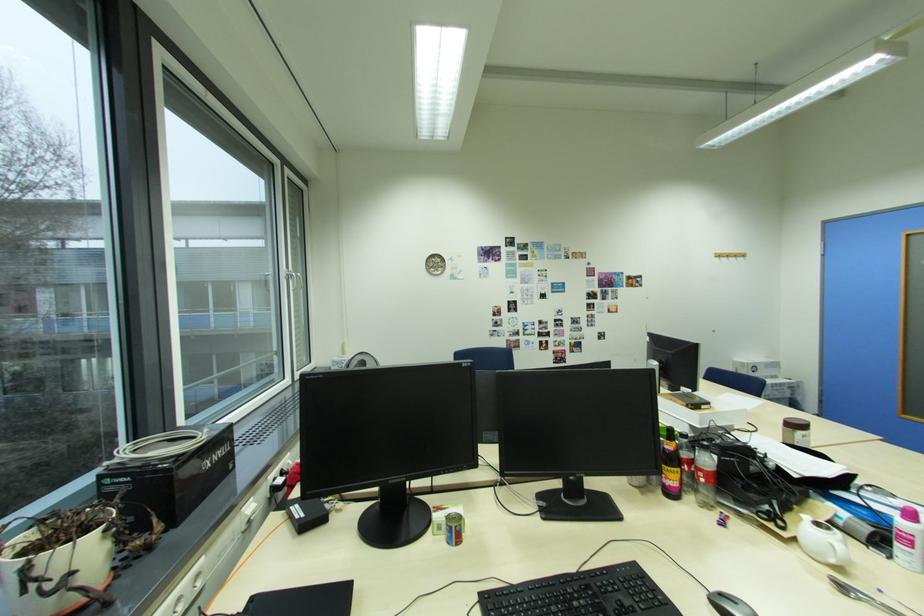
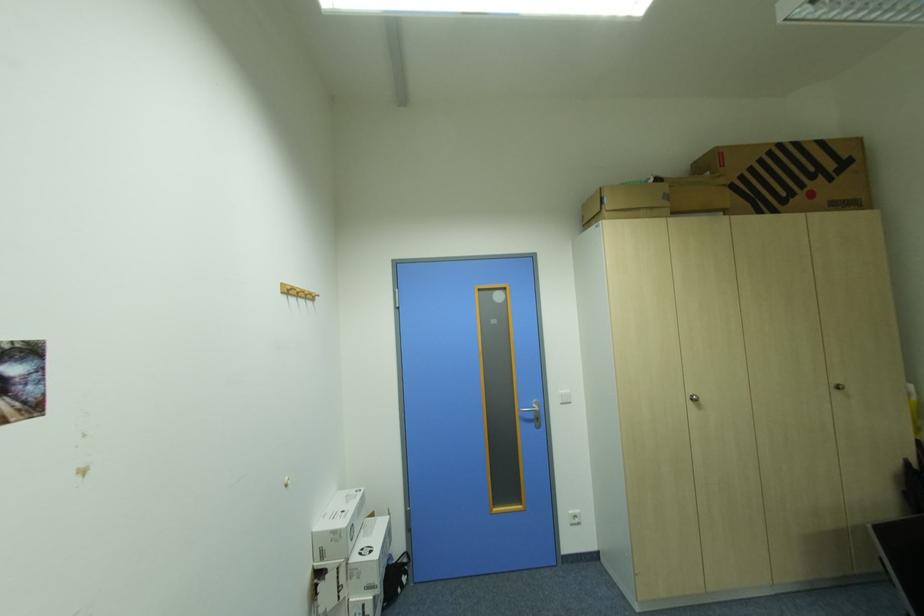
In the second image, find the point that corresponds to point (723, 257) in the first image.

(292, 293)